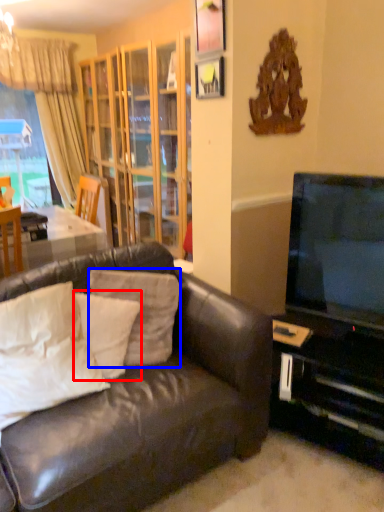
Question: Among these objects, which one is nearest to the camera, pillow (highlighted by a red box) or pillow (highlighted by a blue box)?

Choices:
 (A) pillow
 (B) pillow

Answer: (A)